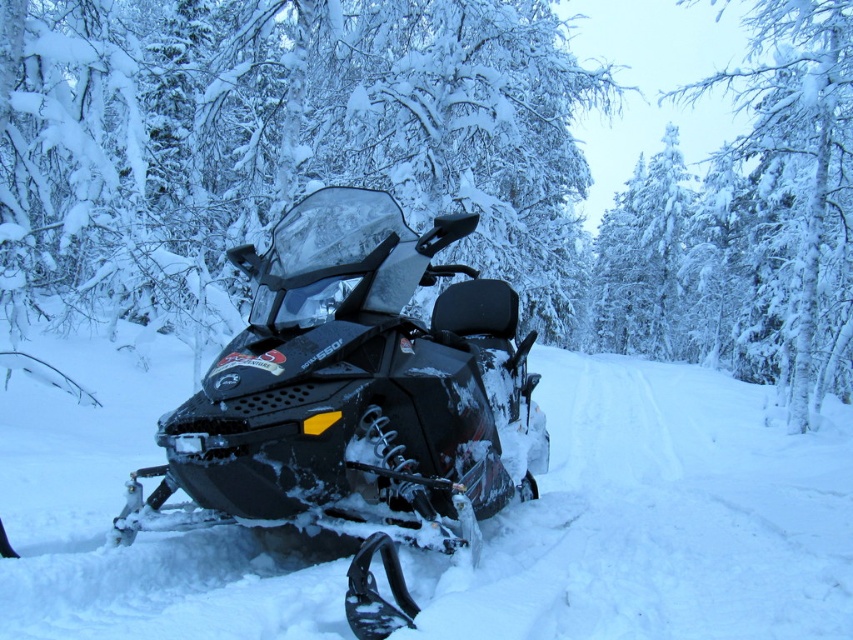
Is snowy branches at center closer to camera compared to matte black snowmobile at center?

No, it is not.

Which is behind, point (225, 49) or point (332, 444)?

Point (225, 49)

Locate an element on the screen. The height and width of the screenshot is (640, 853). snowy branches at center is located at coordinates (427, 170).

Which is in front, point (158, 536) or point (351, 480)?

Point (351, 480) is more forward.

Does point (648, 532) come closer to viewer compared to point (384, 627)?

No, it is not.

Between point (701, 426) and point (322, 403), which one is positioned behind?

The point (701, 426) is behind.

Where is `white matte snow at center`? This screenshot has width=853, height=640. white matte snow at center is located at coordinates (659, 516).

Is point (106, 132) in front of point (422, 602)?

No, (106, 132) is behind (422, 602).

Does snowy branches at center have a larger size compared to white matte snow at center?

Yes, snowy branches at center is bigger than white matte snow at center.

Who is more forward, (x=306, y=182) or (x=482, y=570)?

Point (x=482, y=570) is more forward.

Locate an element on the screen. This screenshot has width=853, height=640. snowy branches at center is located at coordinates coord(427,170).